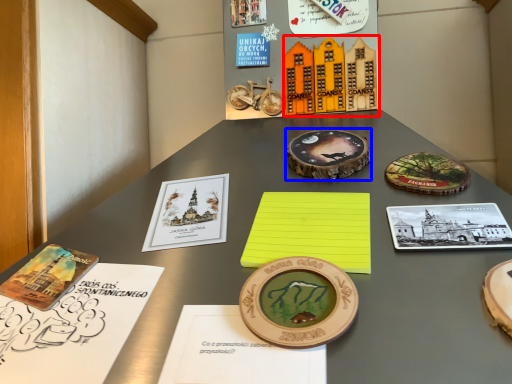
Question: Which object appears closest to the camera in this image, toy (highlighted by a red box) or coin (highlighted by a blue box)?

Choices:
 (A) toy
 (B) coin

Answer: (B)